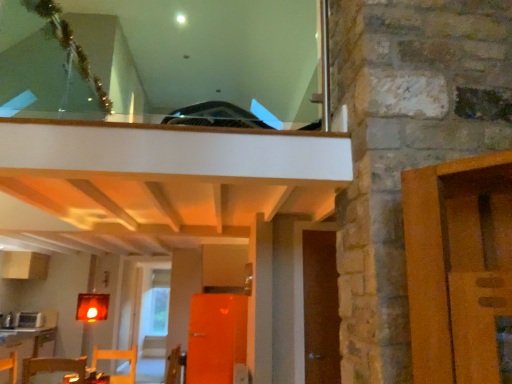
The width and height of the screenshot is (512, 384). What do you see at coordinates (321, 308) in the screenshot?
I see `brown wooden door at right` at bounding box center [321, 308].

The height and width of the screenshot is (384, 512). What are the coordinates of `white glossy microwave at lower left` in the screenshot? It's located at (29, 320).

The width and height of the screenshot is (512, 384). What do you see at coordinates (27, 344) in the screenshot?
I see `wooden table at lower left, which is the 1th table in left-to-right order` at bounding box center [27, 344].

At what (x,y) coordinates should I click in order to perform the action: click on wooden table at lower left, placed as the 1th table when sorted from front to back. Please return your answer as a coordinate pair (x, y). Looking at the image, I should click on (96, 377).

Identify the location of brown wooden door at right. coord(321,308).

Considering the relative sizes of wooden table at lower left, placed as the first table when sorted from back to front, and brown wooden door at right in the image provided, is wooden table at lower left, placed as the first table when sorted from back to front, smaller than brown wooden door at right?

Actually, wooden table at lower left, placed as the first table when sorted from back to front, might be larger than brown wooden door at right.

From the image's perspective, is wooden table at lower left, the second table positioned from the front, located above brown wooden door at right?

No, from the image's perspective, wooden table at lower left, the second table positioned from the front, is not on top of brown wooden door at right.

In the scene shown: From a real-world perspective, is wooden table at lower left, the 2th table when ordered from right to left, physically located above or below brown wooden door at right?

From a real-world perspective, wooden table at lower left, the 2th table when ordered from right to left, is physically below brown wooden door at right.

Find the location of a particular element. This screenshot has width=512, height=384. door above the wooden table at lower left, the first table when ordered from bottom to top (from a real-world perspective) is located at coordinates (321, 308).

Which object is further away from the camera, wooden table at lower left, the 1th table when ordered from right to left, or white glossy microwave at lower left?

white glossy microwave at lower left is further from the camera.

Does wooden table at lower left, which is counted as the second table, starting from the back, have a greater width compared to white glossy microwave at lower left?

No, wooden table at lower left, which is counted as the second table, starting from the back, is not wider than white glossy microwave at lower left.

Between wooden table at lower left, the second table in the left-to-right sequence, and white glossy microwave at lower left, which one has larger size?

Bigger between the two is white glossy microwave at lower left.

Is wooden table at lower left, which is counted as the second table, starting from the back, positioned with its back to white glossy microwave at lower left?

Yes, wooden table at lower left, which is counted as the second table, starting from the back, is facing away from white glossy microwave at lower left.

Consider the image. Are wooden chair at lower left and white glossy microwave at lower left far apart?

wooden chair at lower left is far away from white glossy microwave at lower left.

Locate an element on the screen. Image resolution: width=512 pixels, height=384 pixels. appliance that appears on the left of wooden chair at lower left is located at coordinates (29, 320).

Is point (133, 376) in front of point (22, 315)?

Yes, point (133, 376) is in front of point (22, 315).

Locate an element on the screen. This screenshot has width=512, height=384. furniture that is under the white glossy microwave at lower left (from a real-world perspective) is located at coordinates (117, 359).

Considering the sizes of objects white glossy microwave at lower left and wooden chair at lower left in the image provided, who is bigger, white glossy microwave at lower left or wooden chair at lower left?

wooden chair at lower left is bigger.

From a real-world perspective, is brown wooden door at right positioned above or below wooden table at lower left, placed as the first table when sorted from back to front?

In terms of real-world spatial position, brown wooden door at right is above wooden table at lower left, placed as the first table when sorted from back to front.

Does brown wooden door at right lie in front of wooden table at lower left, which is the 1th table in left-to-right order?

That is True.

Considering the sizes of objects brown wooden door at right and wooden table at lower left, the second table positioned from the front, in the image provided, who is thinner, brown wooden door at right or wooden table at lower left, the second table positioned from the front,?

brown wooden door at right is thinner.

Is wooden table at lower left, placed as the first table when sorted from back to front, inside brown wooden door at right?

That's incorrect, wooden table at lower left, placed as the first table when sorted from back to front, is not inside brown wooden door at right.

Between wooden chair at lower left and brown wooden door at right, which one has less height?

With less height is wooden chair at lower left.

Do you think wooden chair at lower left is within brown wooden door at right, or outside of it?

wooden chair at lower left is located beyond the bounds of brown wooden door at right.

Which object is positioned more to the left, wooden chair at lower left or brown wooden door at right?

wooden chair at lower left is more to the left.

From a real-world perspective, does wooden chair at lower left sit lower than brown wooden door at right?

Correct, in the physical world, wooden chair at lower left is lower than brown wooden door at right.

Does white glossy microwave at lower left turn towards wooden table at lower left, the second table positioned from the front?

No, white glossy microwave at lower left is not facing towards wooden table at lower left, the second table positioned from the front.

Is white glossy microwave at lower left at the left side of wooden table at lower left, the 2th table when ordered from right to left?

Indeed, white glossy microwave at lower left is positioned on the left side of wooden table at lower left, the 2th table when ordered from right to left.

Which is further, (x=23, y=324) or (x=50, y=339)?

Positioned behind is point (x=50, y=339).

Where is `table behind the brown wooden door at right`? This screenshot has width=512, height=384. table behind the brown wooden door at right is located at coordinates (27, 344).

Starting from the white glossy microwave at lower left, which table is the 2nd one in front? Please provide its 2D coordinates.

[(96, 377)]

From the image, which object appears to be farther from white glossy microwave at lower left, wooden table at lower left, the 2th table when ordered from right to left, or wooden table at lower left, which is counted as the second table, starting from the back?

wooden table at lower left, which is counted as the second table, starting from the back, is further to white glossy microwave at lower left.

Which object lies further to the anchor point white glossy microwave at lower left, wooden chair at lower left or wooden table at lower left, which is counted as the second table, starting from the back?

The object further to white glossy microwave at lower left is wooden table at lower left, which is counted as the second table, starting from the back.

Based on their spatial positions, is wooden chair at lower left or white glossy microwave at lower left closer to wooden table at lower left, placed as the 1th table when sorted from front to back?

The object closer to wooden table at lower left, placed as the 1th table when sorted from front to back, is wooden chair at lower left.

Estimate the real-world distances between objects in this image. Which object is further from wooden table at lower left, arranged as the 1th table when viewed from the top, white glossy microwave at lower left or brown wooden door at right?

Based on the image, white glossy microwave at lower left appears to be further to wooden table at lower left, arranged as the 1th table when viewed from the top.

When comparing their distances from wooden chair at lower left, does white glossy microwave at lower left or wooden table at lower left, the first table when ordered from bottom to top, seem further?

white glossy microwave at lower left lies further to wooden chair at lower left than the other object.

Estimate the real-world distances between objects in this image. Which object is closer to white glossy microwave at lower left, wooden chair at lower left or wooden table at lower left, the 2th table when ordered from right to left?

Among the two, wooden table at lower left, the 2th table when ordered from right to left, is located nearer to white glossy microwave at lower left.

Estimate the real-world distances between objects in this image. Which object is further from white glossy microwave at lower left, brown wooden door at right or wooden table at lower left, placed as the first table when sorted from back to front?

Based on the image, brown wooden door at right appears to be further to white glossy microwave at lower left.

Consider the image. Considering their positions, is white glossy microwave at lower left positioned closer to brown wooden door at right than wooden table at lower left, the 2th table when ordered from right to left?

wooden table at lower left, the 2th table when ordered from right to left, is closer to brown wooden door at right.

At what (x,y) coordinates should I click in order to perform the action: click on furniture located between wooden table at lower left, arranged as the 1th table when viewed from the top, and wooden table at lower left, the second table positioned from the front, in the depth direction. Please return your answer as a coordinate pair (x, y). The image size is (512, 384). Looking at the image, I should click on (117, 359).

Locate an element on the screen. Image resolution: width=512 pixels, height=384 pixels. furniture positioned between wooden table at lower left, which is counted as the second table, starting from the back, and white glossy microwave at lower left from near to far is located at coordinates (117, 359).

You are a GUI agent. You are given a task and a screenshot of the screen. Output one action in this format:
    pyautogui.click(x=<x>, y=<y>)
    Task: Click on the table between wooden table at lower left, arranged as the 1th table when viewed from the top, and white glossy microwave at lower left, along the z-axis
    Image resolution: width=512 pixels, height=384 pixels.
    Given the screenshot: What is the action you would take?
    pyautogui.click(x=27, y=344)

The image size is (512, 384). In order to click on furniture between white glossy microwave at lower left and brown wooden door at right in this screenshot , I will do `click(117, 359)`.